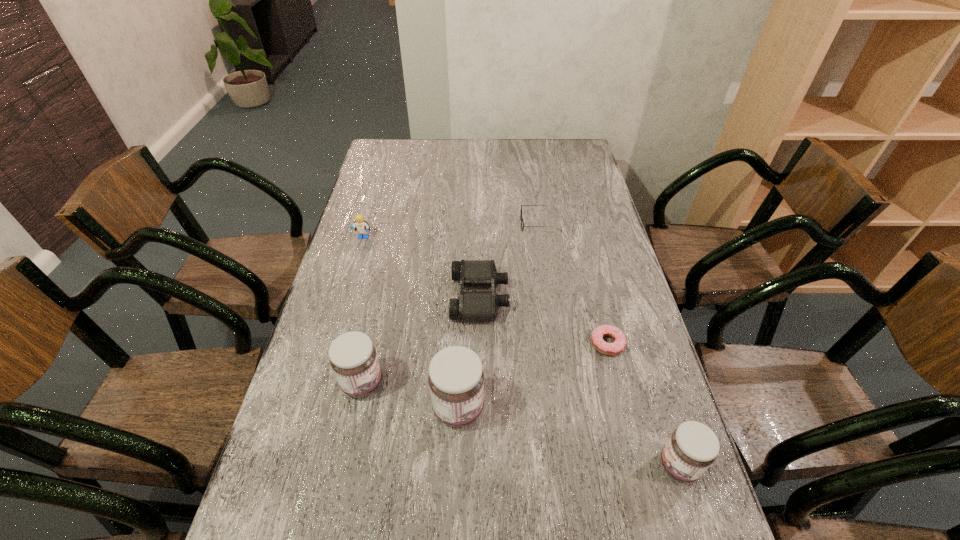
Where is `the second tallest object`? the second tallest object is located at coordinates coord(353,358).

The image size is (960, 540). I want to click on the second tallest jam, so click(353, 358).

Find the location of a particular element. Image resolution: width=960 pixels, height=540 pixels. the second jam from right to left is located at coordinates (456, 378).

The width and height of the screenshot is (960, 540). In order to click on the nearest object in this screenshot , I will do `click(693, 447)`.

Identify the location of the nearest jam. (693, 447).

At what (x,y) coordinates should I click in order to perform the action: click on the sixth tallest object. Please return your answer as a coordinate pair (x, y). The width and height of the screenshot is (960, 540). Looking at the image, I should click on (521, 218).

Where is `spectacles`? This screenshot has width=960, height=540. spectacles is located at coordinates (521, 218).

At what (x,y) coordinates should I click in order to perform the action: click on the third farthest object. Please return your answer as a coordinate pair (x, y). This screenshot has width=960, height=540. Looking at the image, I should click on (471, 306).

Where is `binoculars`? This screenshot has width=960, height=540. binoculars is located at coordinates (x=471, y=306).

Where is `the fourth shortest object`? This screenshot has height=540, width=960. the fourth shortest object is located at coordinates (361, 226).